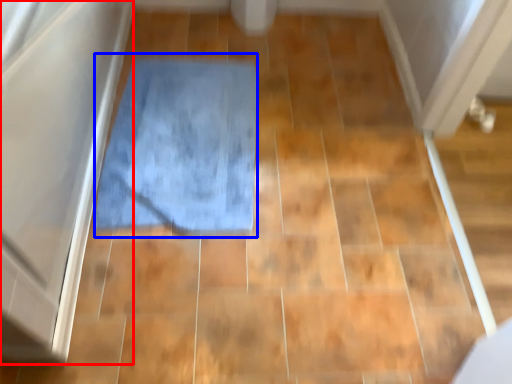
Question: Which of the following is the farthest to the observer, screen door (highlighted by a red box) or bath mat (highlighted by a blue box)?

Choices:
 (A) screen door
 (B) bath mat

Answer: (B)